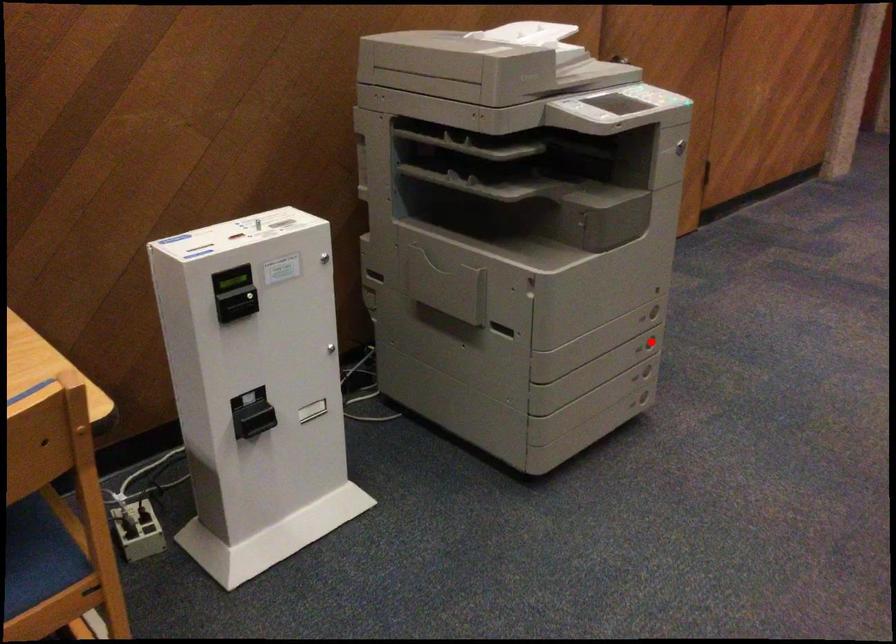
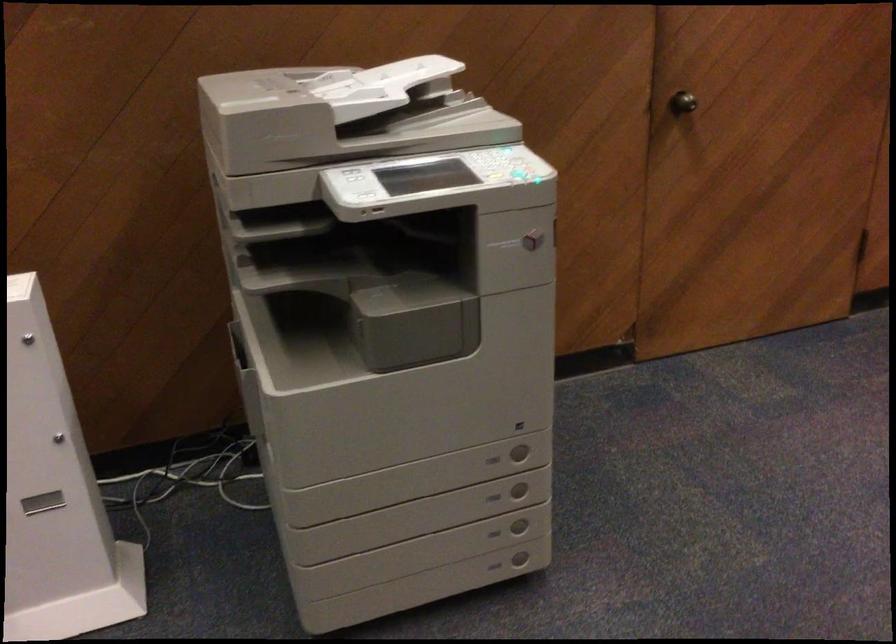
Question: I am providing you with two images of the same scene from different viewpoints. A red point is shown in image1. For the corresponding object point in image2, is it positioned nearer or farther from the camera?

Choices:
 (A) Nearer
 (B) Farther

Answer: (A)